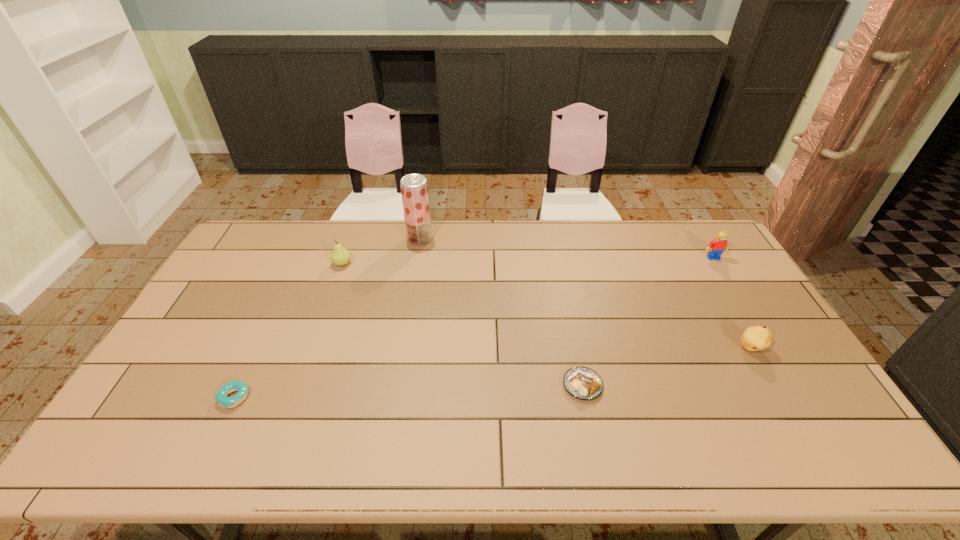
Identify the location of Lego at the right edge. This screenshot has width=960, height=540. (716, 247).

Where is `pear present at the right edge`? The height and width of the screenshot is (540, 960). pear present at the right edge is located at coordinates [755, 338].

At what (x,y) coordinates should I click in order to perform the action: click on object that is at the far right corner. Please return your answer as a coordinate pair (x, y). The height and width of the screenshot is (540, 960). Looking at the image, I should click on (716, 247).

You are a GUI agent. You are given a task and a screenshot of the screen. Output one action in this format:
    pyautogui.click(x=<x>, y=<y>)
    Task: Click on the vacant area at the far edge of the desktop
    The height and width of the screenshot is (540, 960).
    Given the screenshot: What is the action you would take?
    pyautogui.click(x=344, y=221)

Locate an element on the screen. vacant space at the near edge of the desktop is located at coordinates (639, 455).

You are a GUI agent. You are given a task and a screenshot of the screen. Output one action in this format:
    pyautogui.click(x=<x>, y=<y>)
    Task: Click on the free location at the left edge
    This screenshot has height=540, width=960.
    Given the screenshot: What is the action you would take?
    pyautogui.click(x=135, y=428)

You are a GUI agent. You are given a task and a screenshot of the screen. Output one action in this format:
    pyautogui.click(x=<x>, y=<y>)
    Task: Click on the blank area at the right edge
    
    Given the screenshot: What is the action you would take?
    pyautogui.click(x=833, y=423)

Identify the location of free space at the far right corner. click(679, 220).

Where is `unoccupied area between the fourth farthest object and the doughnut`? Image resolution: width=960 pixels, height=540 pixels. unoccupied area between the fourth farthest object and the doughnut is located at coordinates (492, 373).

This screenshot has width=960, height=540. In order to click on free area in between the Lego and the third object from left to right in this screenshot , I will do `click(566, 248)`.